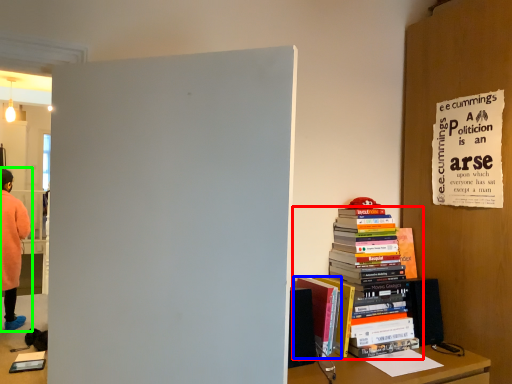
Question: Which object is positioned closest to book (highlighted by a red box)? Select from book (highlighted by a blue box) and person (highlighted by a green box).

Choices:
 (A) book
 (B) person

Answer: (A)